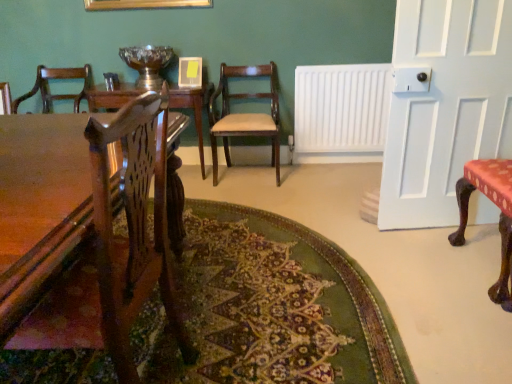
Question: In terms of size, does wooden table at center appear bigger or smaller than mahogany wood chair at center, the second chair in the front-to-back sequence?

Choices:
 (A) small
 (B) big

Answer: (B)

Question: From the image's perspective, is wooden table at center above or below mahogany wood chair at center, the second chair in the front-to-back sequence?

Choices:
 (A) above
 (B) below

Answer: (B)

Question: Estimate the real-world distances between objects in this image. Which object is closer to the mahogany wood chair at center, the first chair when ordered from back to front?

Choices:
 (A) red fabric-covered chair at right, which is the 2th chair in back-to-front order
 (B) white painted wood door at right
 (C) green textured rug at center
 (D) wooden table at center
 (E) wooden table at center

Answer: (E)

Question: Based on their relative distances, which object is nearer to the white painted wood door at right?

Choices:
 (A) wooden table at center
 (B) red fabric-covered chair at right, the first chair from the front
 (C) wooden table at center
 (D) green textured rug at center
 (E) white plastic radiator at center

Answer: (B)